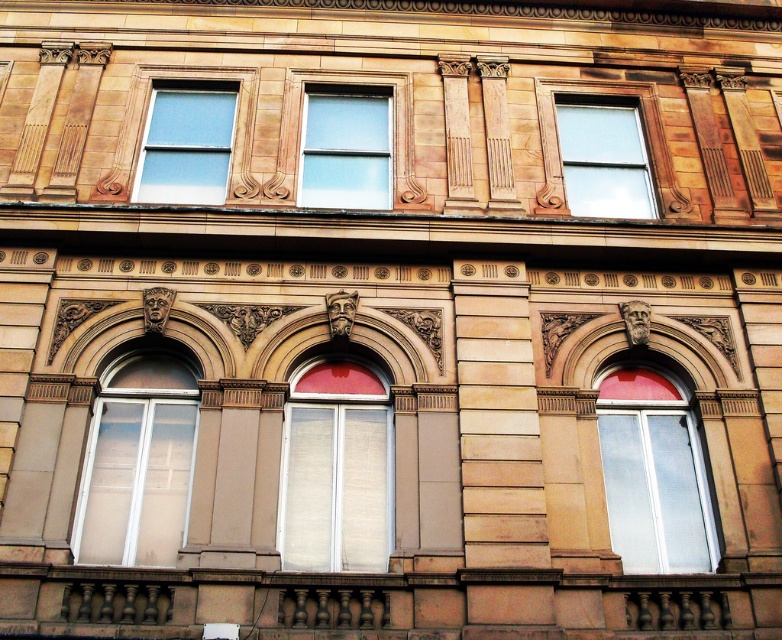
Question: Which object is farther from the camera taking this photo?

Choices:
 (A) clear glass window at center right
 (B) white glass window at center

Answer: (A)

Question: In this image, where is white glass window at center located relative to clear glass window at center right?

Choices:
 (A) below
 (B) above

Answer: (B)

Question: Based on their relative distances, which object is nearer to the matte glass window at upper left?

Choices:
 (A) white glass window at center
 (B) white matte window at center

Answer: (A)

Question: Is white glass window at center above clear glass window at center?

Choices:
 (A) no
 (B) yes

Answer: (A)

Question: Which of the following is the farthest from the observer?

Choices:
 (A) matte glass window at upper left
 (B) clear glass window at center right

Answer: (A)

Question: Can you confirm if white glass window at center is smaller than clear glass window at center?

Choices:
 (A) yes
 (B) no

Answer: (B)